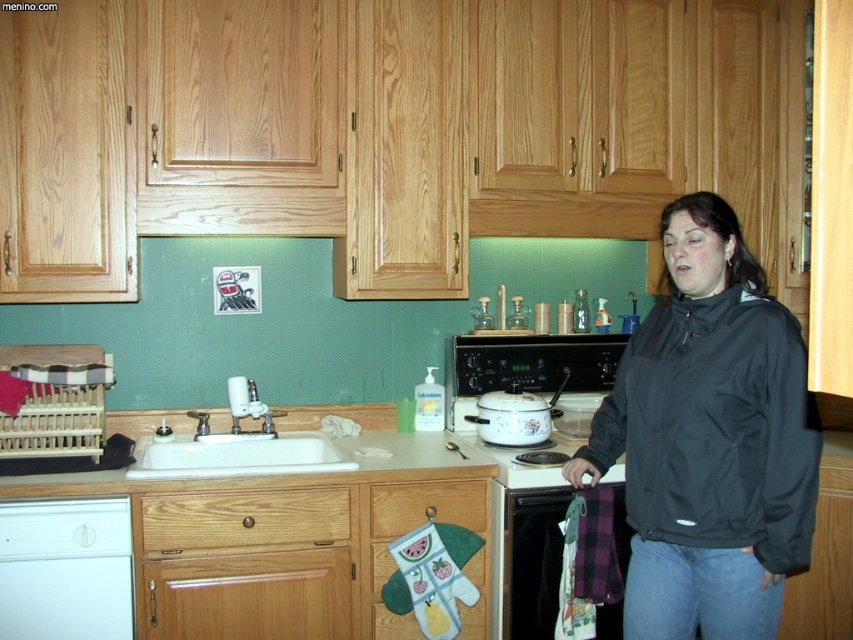
Question: Which of these objects is positioned farthest from the metallic silver oven at lower center?

Choices:
 (A) white ceramic sink at lower left
 (B) white glossy dishwasher at lower left
 (C) white glossy pot at center
 (D) black matte jacket at center

Answer: (B)

Question: Based on their relative distances, which object is farther from the white glossy dishwasher at lower left?

Choices:
 (A) white glossy stove at center
 (B) white ceramic sink at lower left
 (C) white glossy pot at center
 (D) metallic silver oven at lower center

Answer: (C)

Question: Considering the relative positions of metallic silver oven at lower center and white ceramic sink at lower left in the image provided, where is metallic silver oven at lower center located with respect to white ceramic sink at lower left?

Choices:
 (A) right
 (B) left

Answer: (A)

Question: Is white glossy dishwasher at lower left bigger than white glossy pot at center?

Choices:
 (A) no
 (B) yes

Answer: (A)

Question: Among these points, which one is nearest to the camera?

Choices:
 (A) (688, 628)
 (B) (485, 346)
 (C) (0, 518)
 (D) (514, 532)

Answer: (A)

Question: Where is white glossy dishwasher at lower left located in relation to metallic silver oven at lower center in the image?

Choices:
 (A) above
 (B) below

Answer: (A)